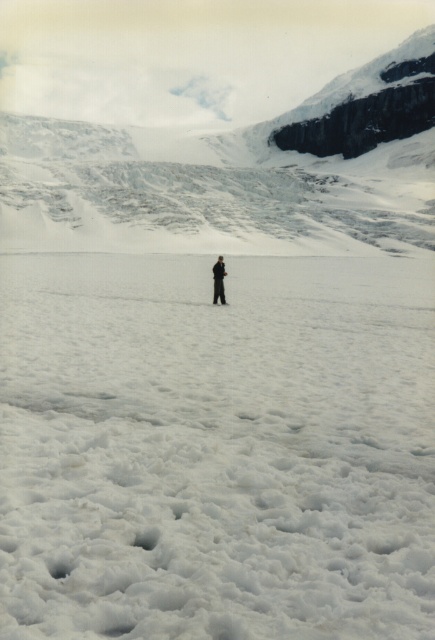
Between snowy rock at upper center and blurred figure at center, which one has more height?

snowy rock at upper center

Can you confirm if snowy rock at upper center is smaller than blurred figure at center?

Actually, snowy rock at upper center might be larger than blurred figure at center.

Does point (93, 246) come farther from viewer compared to point (221, 260)?

Yes, point (93, 246) is behind point (221, 260).

Where is `snowy rock at upper center`? snowy rock at upper center is located at coordinates (204, 125).

Does point (20, 564) come closer to viewer compared to point (147, 184)?

Yes, point (20, 564) is in front of point (147, 184).

Who is taller, white fluffy snow at center or snowy rock at upper center?

With more height is snowy rock at upper center.

You are a GUI agent. You are given a task and a screenshot of the screen. Output one action in this format:
    pyautogui.click(x=<x>, y=<y>)
    Task: Click on the white fluffy snow at center
    The image size is (435, 640).
    Given the screenshot: What is the action you would take?
    pyautogui.click(x=216, y=449)

The width and height of the screenshot is (435, 640). Find the location of `white fluffy snow at center`. white fluffy snow at center is located at coordinates (216, 449).

Can you confirm if white fluffy snow at center is thinner than blurred figure at center?

No.

Measure the distance between white fluffy snow at center and blurred figure at center.

A distance of 7.27 meters exists between white fluffy snow at center and blurred figure at center.

Between point (358, 632) and point (214, 291), which one is positioned behind?

The point (214, 291) is behind.

Locate an element on the screen. The height and width of the screenshot is (640, 435). white fluffy snow at center is located at coordinates (216, 449).